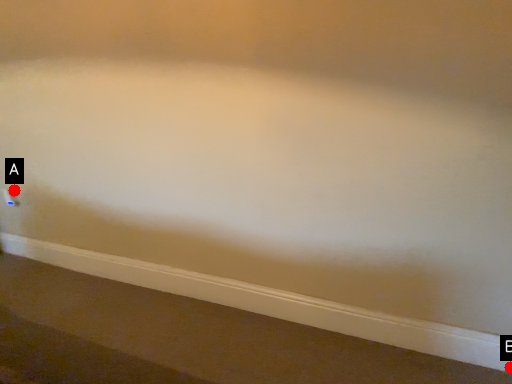
Question: Two points are circled on the image, labeled by A and B beside each circle. Which point is farther from the camera taking this photo?

Choices:
 (A) A is further
 (B) B is further

Answer: (A)